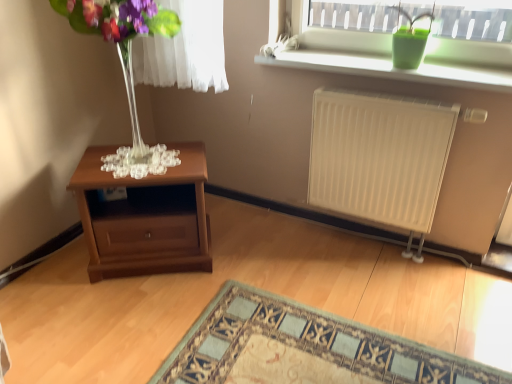
You are a GUI agent. You are given a task and a screenshot of the screen. Output one action in this format:
    pyautogui.click(x=<x>, y=<y>)
    Task: Click on the free region on the left part of green matte pot at upper right
    
    Given the screenshot: What is the action you would take?
    pyautogui.click(x=364, y=63)